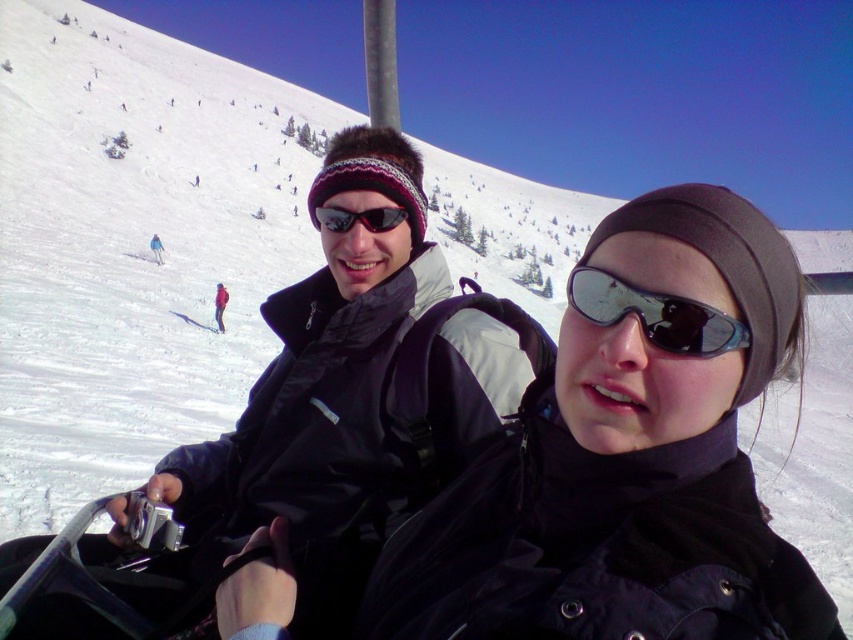
Question: Can you confirm if black reflective goggles at center is positioned to the left of black reflective sunglasses at center?

Choices:
 (A) no
 (B) yes

Answer: (A)

Question: Can you confirm if black reflective goggles at center is smaller than black reflective sunglasses at center?

Choices:
 (A) yes
 (B) no

Answer: (B)

Question: Which of the following is the farthest from the observer?

Choices:
 (A) (380, 205)
 (B) (671, 333)

Answer: (A)

Question: Can you confirm if black reflective goggles at center is positioned to the right of black reflective sunglasses at center?

Choices:
 (A) no
 (B) yes

Answer: (B)

Question: Which point is closer to the camera taking this photo?

Choices:
 (A) (706, 353)
 (B) (390, 216)

Answer: (A)